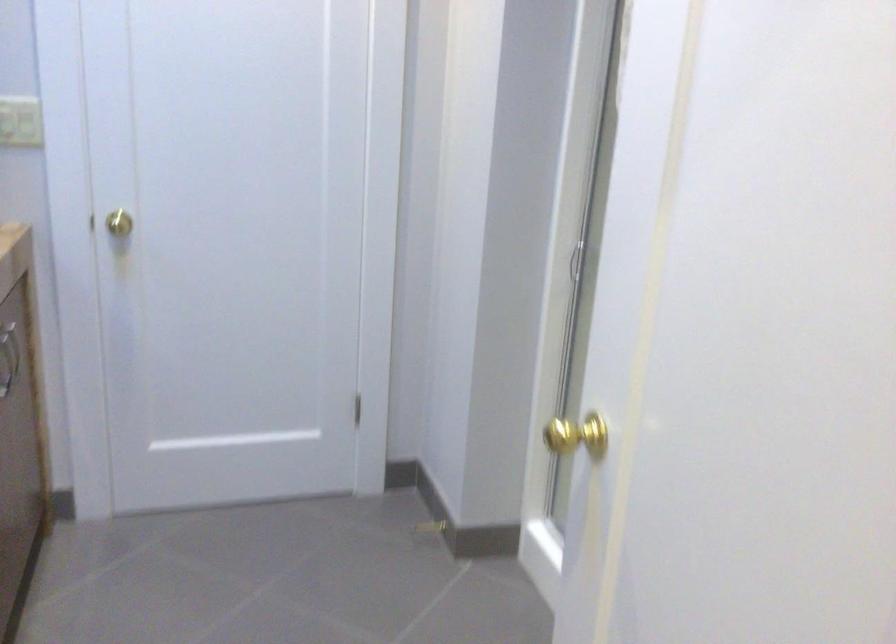
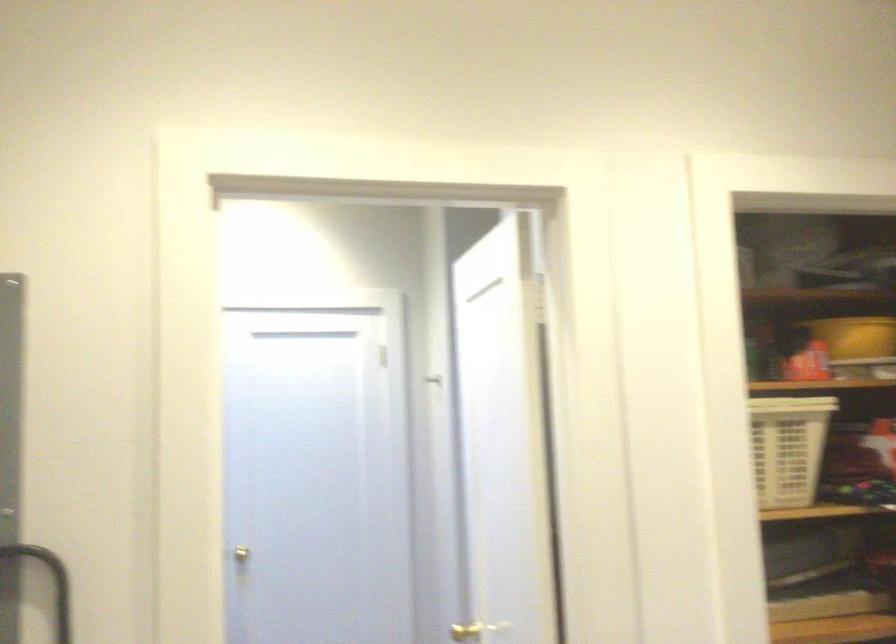
Find the pixel in the second image that matches (130,218) in the first image.

(253, 553)